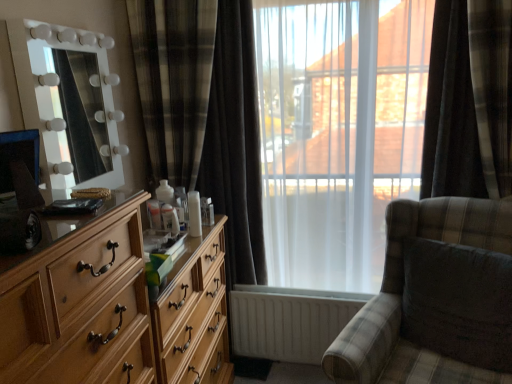
Question: Is light wood dresser at left not inside white glossy mirror at left?

Choices:
 (A) yes
 (B) no

Answer: (A)

Question: From the image's perspective, would you say light wood dresser at left is shown under white glossy mirror at left?

Choices:
 (A) no
 (B) yes

Answer: (B)

Question: From a real-world perspective, does light wood dresser at left stand above white glossy mirror at left?

Choices:
 (A) yes
 (B) no

Answer: (B)

Question: Is light wood dresser at left touching white glossy mirror at left?

Choices:
 (A) yes
 (B) no

Answer: (B)

Question: Is light wood dresser at left facing away from white glossy mirror at left?

Choices:
 (A) no
 (B) yes

Answer: (A)

Question: Based on their sizes in the image, would you say plaid fabric rocking chair at center is bigger or smaller than light wood dresser at left?

Choices:
 (A) big
 (B) small

Answer: (A)

Question: Based on their positions, is plaid fabric rocking chair at center located to the left or right of light wood dresser at left?

Choices:
 (A) left
 (B) right

Answer: (B)

Question: From a real-world perspective, is plaid fabric rocking chair at center physically located above or below light wood dresser at left?

Choices:
 (A) above
 (B) below

Answer: (A)

Question: Is point (394, 231) closer or farther from the camera than point (161, 324)?

Choices:
 (A) closer
 (B) farther

Answer: (B)

Question: From a real-world perspective, is dark plaid curtain at right, which ranks as the 2th curtain in left-to-right order, positioned above or below white glossy mirror at left?

Choices:
 (A) above
 (B) below

Answer: (B)

Question: From the image's perspective, is dark plaid curtain at right, which ranks as the 2th curtain in left-to-right order, located above or below white glossy mirror at left?

Choices:
 (A) below
 (B) above

Answer: (B)

Question: Is dark plaid curtain at right, which ranks as the 2th curtain in left-to-right order, inside or outside of white glossy mirror at left?

Choices:
 (A) outside
 (B) inside

Answer: (A)

Question: Considering the positions of dark plaid curtain at right, the first curtain viewed from the right, and white glossy mirror at left in the image, is dark plaid curtain at right, the first curtain viewed from the right, bigger or smaller than white glossy mirror at left?

Choices:
 (A) big
 (B) small

Answer: (A)

Question: Based on their sizes in the image, would you say plaid fabric swivel chair at right is bigger or smaller than plaid fabric rocking chair at center?

Choices:
 (A) small
 (B) big

Answer: (A)

Question: In terms of width, does plaid fabric swivel chair at right look wider or thinner when compared to plaid fabric rocking chair at center?

Choices:
 (A) wide
 (B) thin

Answer: (B)